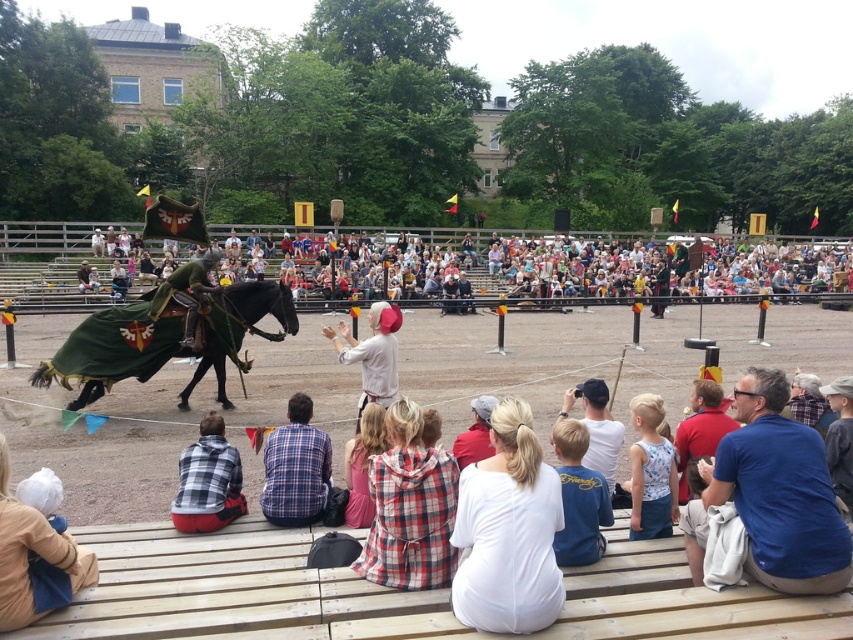
Image resolution: width=853 pixels, height=640 pixels. What do you see at coordinates (508, 531) in the screenshot?
I see `white cotton dress at center` at bounding box center [508, 531].

Identify the location of white cotton dress at center. The width and height of the screenshot is (853, 640). (508, 531).

This screenshot has width=853, height=640. I want to click on white cotton dress at center, so click(508, 531).

Which is more to the left, green velvet cloth at left or white cotton tank top at center?

Positioned to the left is green velvet cloth at left.

Can you confirm if green velvet cloth at left is positioned above white cotton tank top at center?

Yes, green velvet cloth at left is above white cotton tank top at center.

Identify the location of green velvet cloth at left. The height and width of the screenshot is (640, 853). (164, 340).

Locate an element on the screen. This screenshot has width=853, height=640. green velvet cloth at left is located at coordinates (164, 340).

Between blue cotton shirt at lower right and white cotton hat at center, which one appears on the left side from the viewer's perspective?

white cotton hat at center is more to the left.

Which of these two, blue cotton shirt at lower right or white cotton hat at center, stands taller?

With more height is blue cotton shirt at lower right.

Find the location of a particular element. The height and width of the screenshot is (640, 853). blue cotton shirt at lower right is located at coordinates (779, 492).